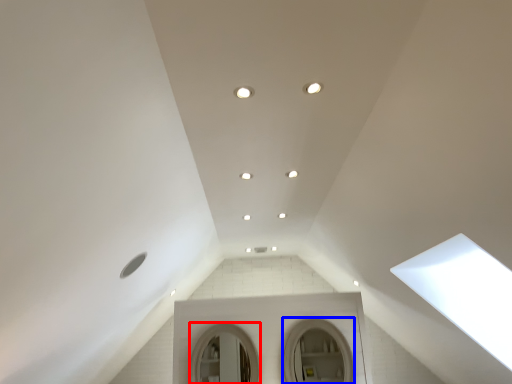
Question: Which of the following is the closest to the observer, mirror (highlighted by a red box) or mirror (highlighted by a blue box)?

Choices:
 (A) mirror
 (B) mirror

Answer: (B)